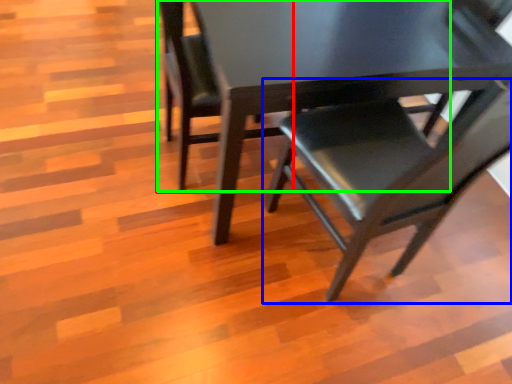
Question: Based on their relative distances, which object is nearer to chair (highlighted by a red box)? Choose from chair (highlighted by a blue box) and chair (highlighted by a green box).

Choices:
 (A) chair
 (B) chair

Answer: (B)